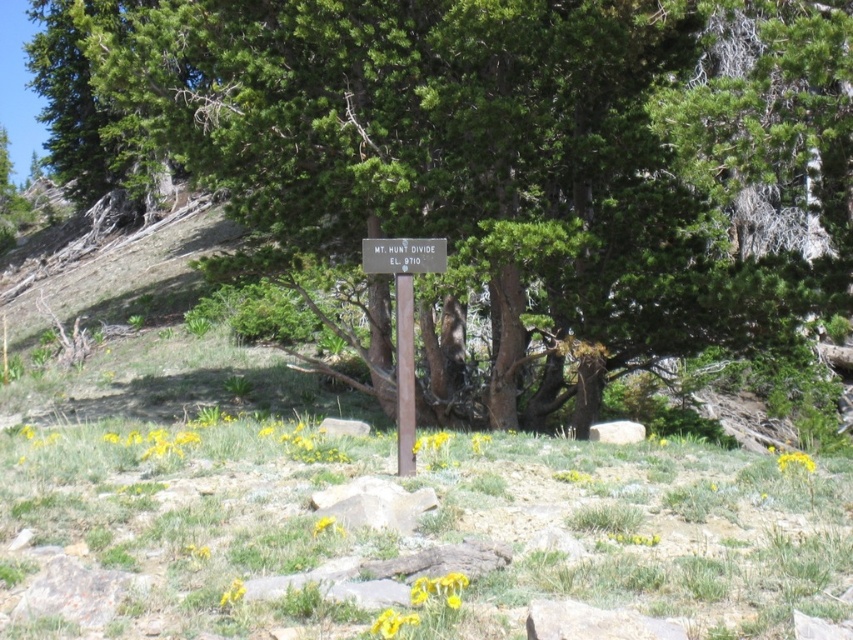
From the picture: You are standing in the middle of the scene and want to walk towards the wooden sign at center. Which direction should you walk to reach it from the green grassy at center?

The wooden sign at center is to the right of the green grassy at center, so you should walk to the right to reach it.

You are standing in the outdoor scene and want to walk towards the green grassy area at center. Which object, the green textured tree at center or the green grassy at center, will you encounter first?

You will encounter the green textured tree at center first because it is closer to you than the green grassy at center, which is behind it.